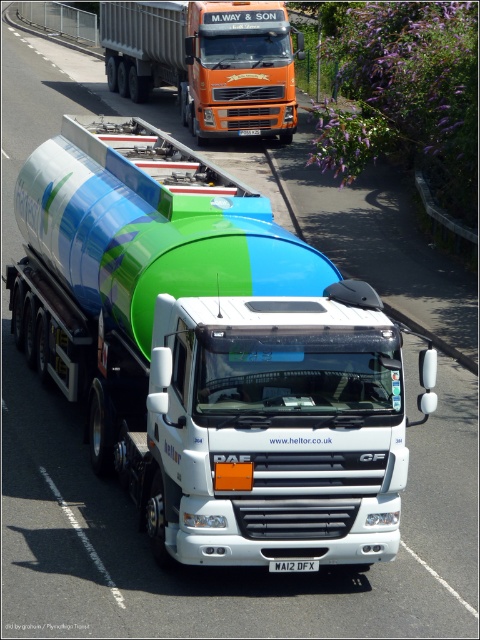
Who is more forward, (242, 492) or (101, 12)?

Point (242, 492) is more forward.

Who is more distant from viewer, (120, 301) or (146, 40)?

The point (146, 40) is behind.

Is point (186, 346) closer to viewer compared to point (223, 83)?

Yes, it is in front of point (223, 83).

Locate an element on the screen. The image size is (480, 640). green matte tanker at center is located at coordinates (208, 353).